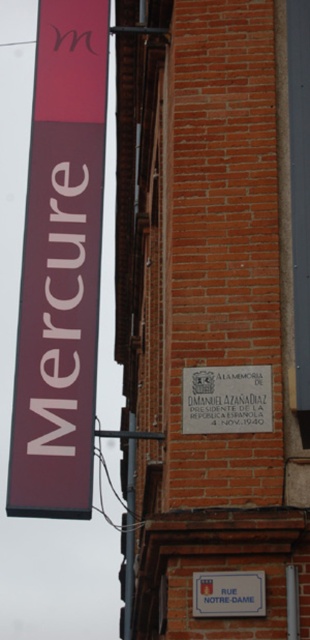
Question: Estimate the real-world distances between objects in this image. Which object is closer to the matte white plaque at center?

Choices:
 (A) white plastic sign at lower center
 (B) matte maroon sign at left
 (C) maroon matte sign at left

Answer: (A)

Question: Observing the image, what is the correct spatial positioning of matte maroon sign at left in reference to matte white plaque at center?

Choices:
 (A) right
 (B) left

Answer: (B)

Question: Which of the following is the farthest from the observer?

Choices:
 (A) (225, 365)
 (B) (80, 467)
 (C) (35, 291)

Answer: (C)

Question: Which is nearer to the white plastic sign at lower center?

Choices:
 (A) matte white plaque at center
 (B) matte maroon sign at left
 (C) maroon matte sign at left

Answer: (A)

Question: Does maroon matte sign at left appear on the left side of matte white plaque at center?

Choices:
 (A) no
 (B) yes

Answer: (B)

Question: Does maroon matte sign at left have a smaller size compared to white plastic sign at lower center?

Choices:
 (A) yes
 (B) no

Answer: (A)